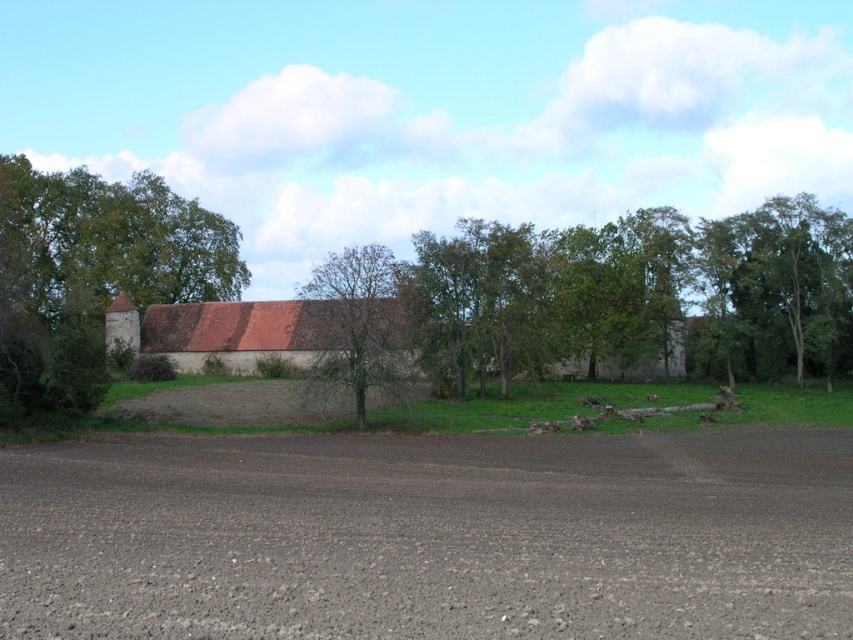
Looking at this image, you are standing at the point closest to you in the image. Which of the two points, point (770,280) or point (367,365), is farther away from your current position?

Point (770,280) is farther away because it is behind point (367,365), which is closer to you.